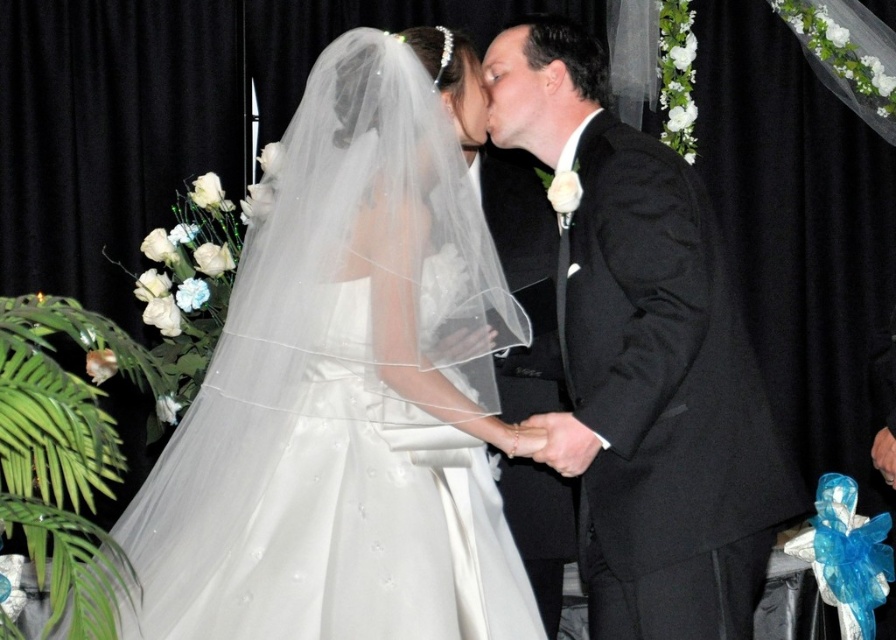
Question: In this image, where is satin white dress at center located relative to black satin suit at center?

Choices:
 (A) right
 (B) left

Answer: (B)

Question: Can you confirm if satin white dress at center is positioned above black satin suit at center?

Choices:
 (A) no
 (B) yes

Answer: (A)

Question: Which object is farther from the camera taking this photo?

Choices:
 (A) black satin suit at center
 (B) satin white dress at center

Answer: (A)

Question: Which point is farther from the camera taking this photo?

Choices:
 (A) (436, 451)
 (B) (744, 627)

Answer: (B)

Question: Does satin white dress at center have a lesser width compared to black satin suit at center?

Choices:
 (A) yes
 (B) no

Answer: (B)